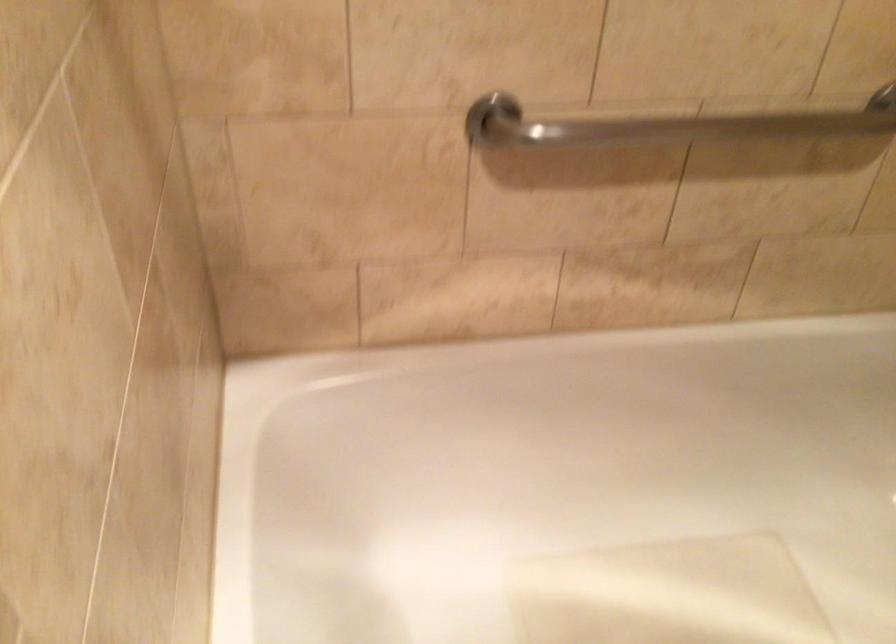
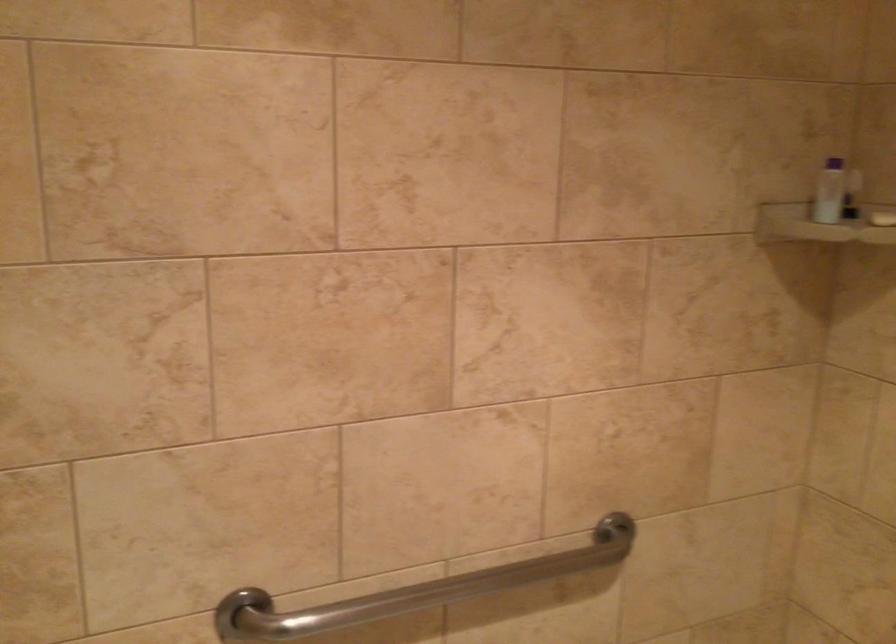
First-person continuous shooting, in which direction is the camera rotating?

The camera rotated toward right-up.